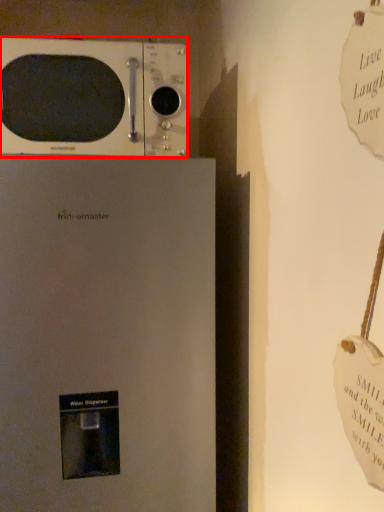
Question: Where is microwave oven (annotated by the red box) located in relation to refrigerator in the image?

Choices:
 (A) right
 (B) left

Answer: (A)